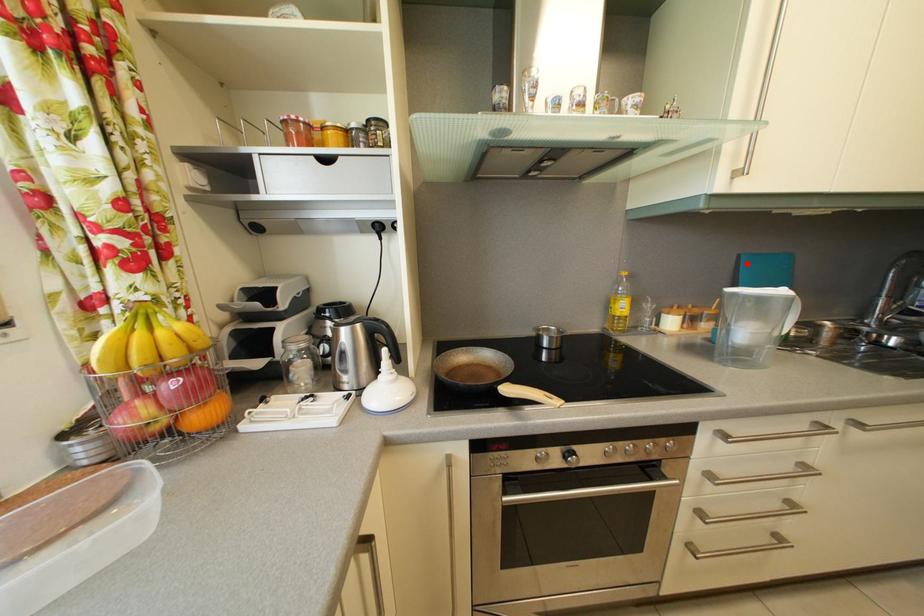
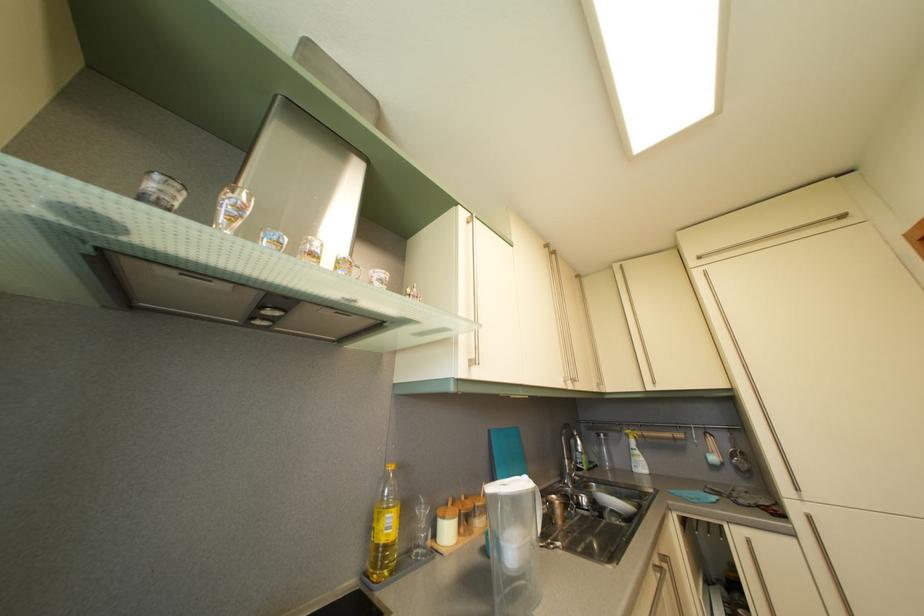
The point at the highlighted location is marked in the first image. Where is the corresponding point in the second image?

(497, 439)